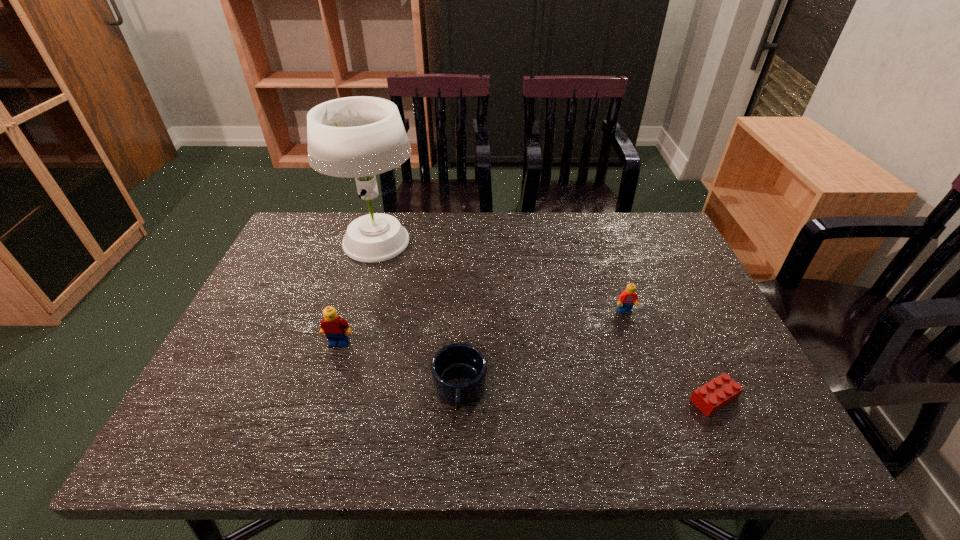
The height and width of the screenshot is (540, 960). Identify the location of Lego that can be found as the second closest to the second tallest Lego. (335, 328).

You are a GUI agent. You are given a task and a screenshot of the screen. Output one action in this format:
    pyautogui.click(x=<x>, y=<y>)
    Task: Click on the vacant space that satisfies the following two spatial constraints: 1. with the handle on the side of the nearest Lego; 2. on the left side of the mug
    The height and width of the screenshot is (540, 960).
    Given the screenshot: What is the action you would take?
    pyautogui.click(x=459, y=399)

Identify the location of free spot that satisfies the following two spatial constraints: 1. on the front-facing side of the nearest Lego; 2. on the left side of the second farthest Lego. (322, 399).

I want to click on vacant point that satisfies the following two spatial constraints: 1. on the front-facing side of the lamp; 2. on the front-facing side of the third nearest object, so click(x=348, y=343).

Find the location of a particular element. The image size is (960, 540). free space in the image that satisfies the following two spatial constraints: 1. on the front-facing side of the rightmost object; 2. on the left side of the tallest Lego is located at coordinates (322, 399).

Identify the location of free spot that satisfies the following two spatial constraints: 1. with the handle on the side of the second shortest object; 2. on the right side of the shortest object. This screenshot has height=540, width=960. (459, 399).